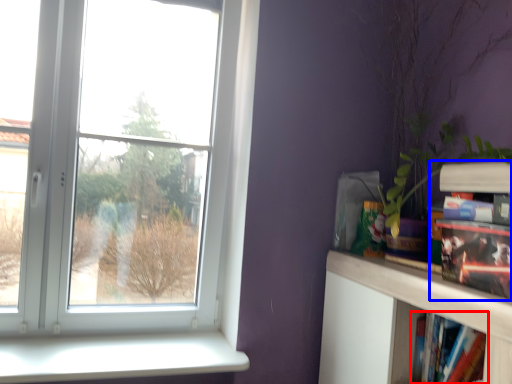
Question: Which object appears closest to the camera in this image, book (highlighted by a red box) or book (highlighted by a blue box)?

Choices:
 (A) book
 (B) book

Answer: (B)